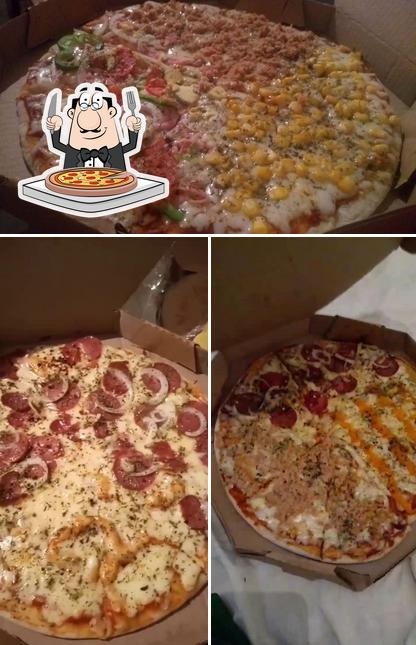
Locate an element on the screen. Image resolution: width=416 pixels, height=645 pixels. fork is located at coordinates (133, 101).